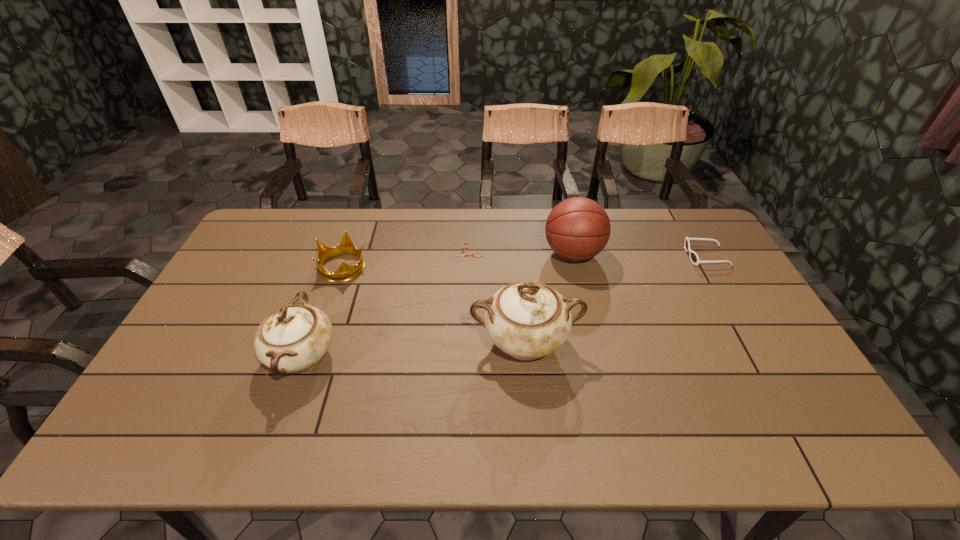
Identify the location of free spot between the basketball and the shorter chinaware. (438, 305).

The height and width of the screenshot is (540, 960). What are the coordinates of `unoccupied area between the shortest object and the fourth tallest object` in the screenshot? It's located at (406, 260).

Identify the location of free space between the taller chinaware and the shorter chinaware. (414, 349).

The height and width of the screenshot is (540, 960). Identify the location of free space between the third shortest object and the taller chinaware. (434, 305).

The height and width of the screenshot is (540, 960). I want to click on object that is the third closest to the basketball, so click(x=694, y=258).

Where is `object that stands as the fifth closest to the third shortest object`? object that stands as the fifth closest to the third shortest object is located at coordinates (694, 258).

Locate an element on the screen. The width and height of the screenshot is (960, 540). vacant area in the image that satisfies the following two spatial constraints: 1. on the back side of the basketball; 2. on the right side of the right chinaware is located at coordinates (516, 254).

Where is `vacant space that satisfies the following two spatial constraints: 1. with the lenses of the second shortest object facing outward; 2. on the front side of the right chinaware`? Image resolution: width=960 pixels, height=540 pixels. vacant space that satisfies the following two spatial constraints: 1. with the lenses of the second shortest object facing outward; 2. on the front side of the right chinaware is located at coordinates (756, 342).

Where is `blank space that satisfies the following two spatial constraints: 1. on the back side of the shears; 2. on the left side of the crown`? This screenshot has width=960, height=540. blank space that satisfies the following two spatial constraints: 1. on the back side of the shears; 2. on the left side of the crown is located at coordinates (348, 253).

Image resolution: width=960 pixels, height=540 pixels. In order to click on vacant region that satisfies the following two spatial constraints: 1. on the back side of the left chinaware; 2. on the right side of the shortest object in this screenshot , I will do `click(340, 253)`.